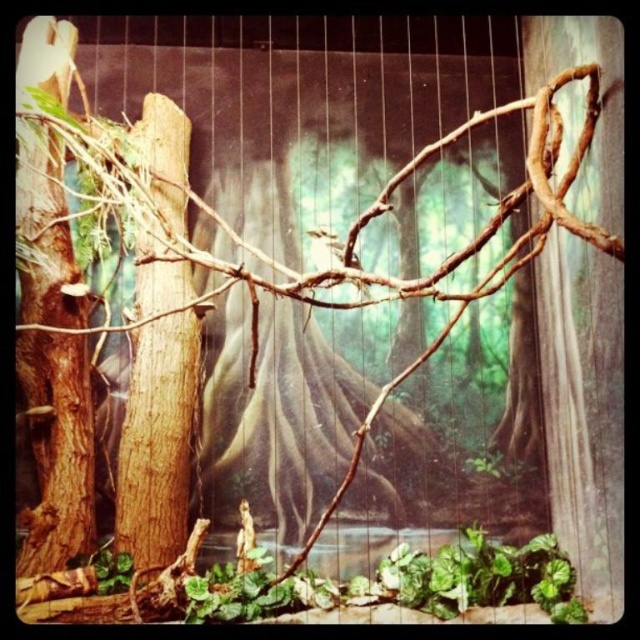
Is point (154, 108) more distant than point (353, 282)?

Yes, point (154, 108) is farther from viewer.

Is brown rough tree trunk at left thinner than brown textured branch at center?

No, brown rough tree trunk at left is not thinner than brown textured branch at center.

Between point (193, 321) and point (332, 237), which one is positioned in front?

Point (193, 321) is in front.

The width and height of the screenshot is (640, 640). I want to click on brown rough tree trunk at left, so click(x=157, y=417).